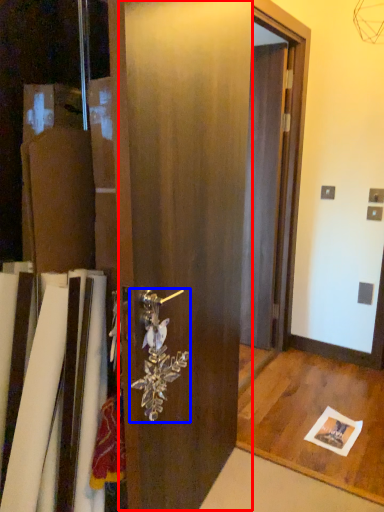
Question: Which point is further to the camera, barn door (highlighted by a red box) or door handle (highlighted by a blue box)?

Choices:
 (A) barn door
 (B) door handle

Answer: (B)